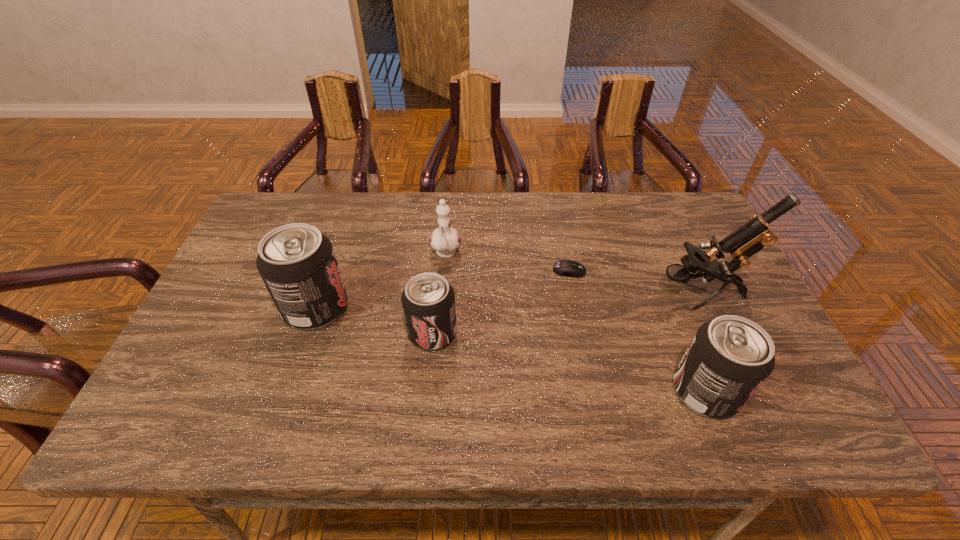
Locate an element on the screen. The image size is (960, 540). free space located 0.100m on the back of the second shortest soda can is located at coordinates (681, 329).

Locate an element on the screen. This screenshot has width=960, height=540. blank space located 0.170m through the eyepiece of the microscope is located at coordinates (594, 294).

The width and height of the screenshot is (960, 540). Identify the location of free space located 0.340m through the eyepiece of the microscope. (531, 294).

Locate an element on the screen. This screenshot has width=960, height=540. free space located 0.120m through the eyepiece of the microscope is located at coordinates (613, 294).

Where is `vacant space situated on the front of the third object from right to left`? This screenshot has width=960, height=540. vacant space situated on the front of the third object from right to left is located at coordinates (573, 291).

Image resolution: width=960 pixels, height=540 pixels. Identify the location of vacant space positioned at the spout of the chinaware. (437, 367).

Image resolution: width=960 pixels, height=540 pixels. In order to click on object that is at the near edge in this screenshot , I will do `click(728, 359)`.

Where is `soda can that is at the right edge`? Image resolution: width=960 pixels, height=540 pixels. soda can that is at the right edge is located at coordinates (728, 359).

Identify the location of microscope present at the right edge. The height and width of the screenshot is (540, 960). (749, 239).

Locate an element on the screen. The image size is (960, 540). object located in the near right corner section of the desktop is located at coordinates (728, 359).